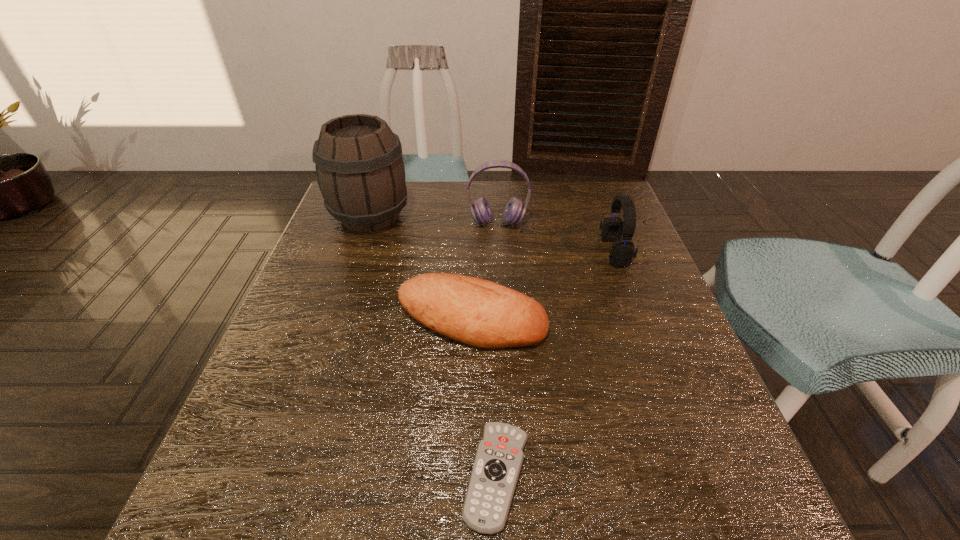
At what (x,y) coordinates should I click in order to perform the action: click on object that is positioned at the left edge. Please return your answer as a coordinate pair (x, y). The width and height of the screenshot is (960, 540). Looking at the image, I should click on (360, 171).

This screenshot has height=540, width=960. I want to click on object present at the right edge, so tap(621, 254).

Identify the location of object that is at the far left corner. (360, 171).

At what (x,y) coordinates should I click in order to perform the action: click on vacant space at the far edge of the desktop. Please return your answer as a coordinate pair (x, y). This screenshot has width=960, height=540. Looking at the image, I should click on (501, 199).

At what (x,y) coordinates should I click in order to perform the action: click on free region at the near edge of the desktop. Please return your answer as a coordinate pair (x, y). The height and width of the screenshot is (540, 960). Looking at the image, I should click on (401, 519).

Locate an element on the screen. This screenshot has width=960, height=540. vacant position at the left edge of the desktop is located at coordinates (295, 402).

The image size is (960, 540). Identify the location of vacant region at the right edge of the desktop. (645, 276).

You are a GUI agent. You are given a task and a screenshot of the screen. Output one action in this format:
    pyautogui.click(x=<x>, y=<y>)
    Task: Click on the vacant position at the near left corner of the desktop
    This screenshot has height=540, width=960.
    Given the screenshot: What is the action you would take?
    pyautogui.click(x=223, y=530)

This screenshot has height=540, width=960. In order to click on vacant space at the far right corner in this screenshot , I will do pyautogui.click(x=583, y=194).

Locate an element on the screen. The image size is (960, 540). vacant space at the near right corner is located at coordinates (708, 481).